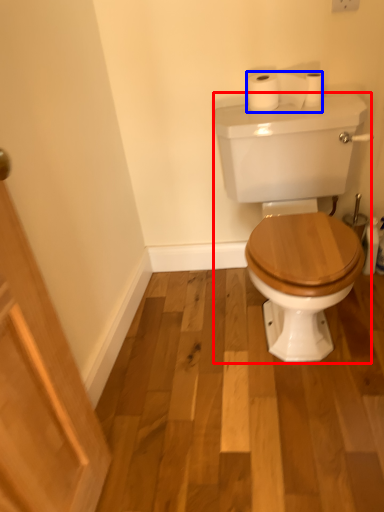
Question: Which point is further to the camera, porcelain (highlighted by a red box) or toilet paper (highlighted by a blue box)?

Choices:
 (A) porcelain
 (B) toilet paper

Answer: (B)